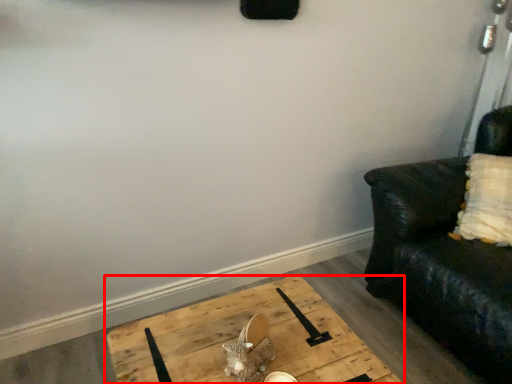
Question: Observing the image, what is the correct spatial positioning of table (annotated by the red box) in reference to studio couch?

Choices:
 (A) left
 (B) right

Answer: (A)